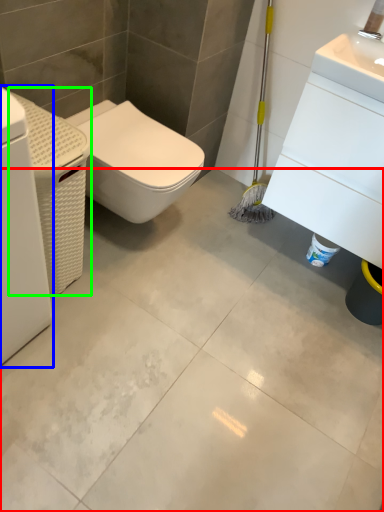
Question: Which is nearer to the concrete (highlighted by a red box)? washing machine (highlighted by a blue box) or porcelain (highlighted by a green box).

Choices:
 (A) washing machine
 (B) porcelain

Answer: (B)